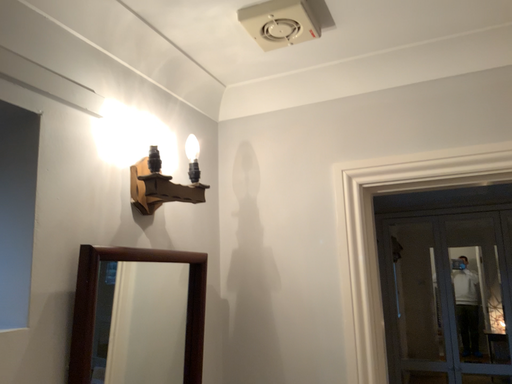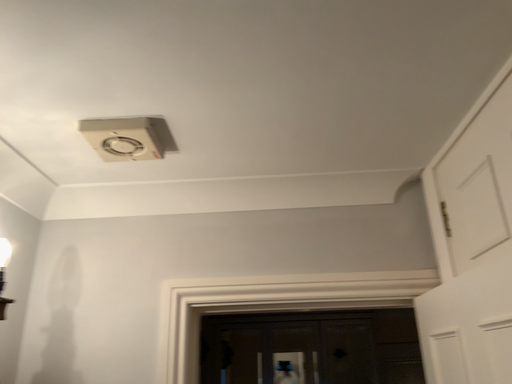
Question: Which way did the camera rotate in the video?

Choices:
 (A) rotated upward
 (B) rotated downward

Answer: (A)